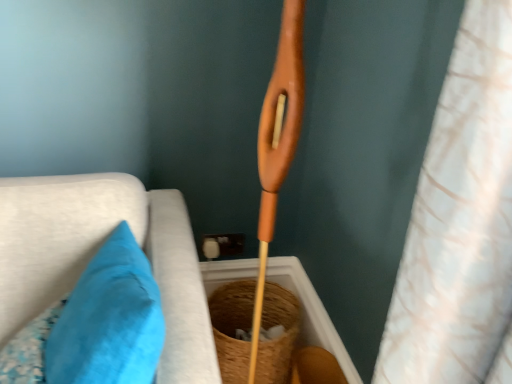
The image size is (512, 384). What do you see at coordinates (96, 251) in the screenshot?
I see `velvet blue pillow at upper left` at bounding box center [96, 251].

Where is `velvet blue pillow at upper left`? The image size is (512, 384). velvet blue pillow at upper left is located at coordinates (96, 251).

This screenshot has height=384, width=512. What are the coordinates of `velvet blue pillow at upper left` in the screenshot? It's located at (96, 251).